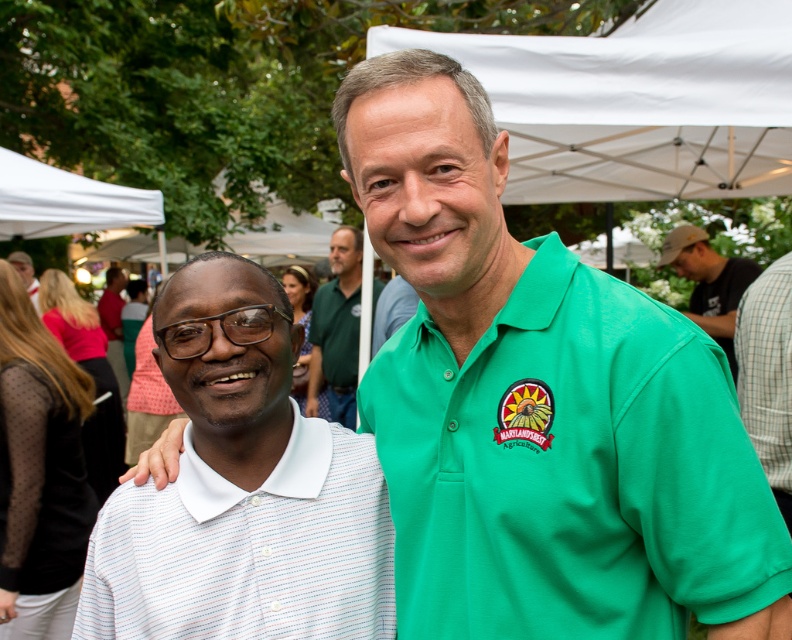
Question: Which point is closer to the camera taking this photo?

Choices:
 (A) (612, 531)
 (B) (310, 340)

Answer: (A)

Question: From the image, what is the correct spatial relationship of white fabric canopy at upper center in relation to green cotton shirt at upper right?

Choices:
 (A) below
 (B) above

Answer: (B)

Question: Which is farther from the white striped polo shirt at left?

Choices:
 (A) green cotton polo shirt at center
 (B) green woven polo shirt at center

Answer: (A)

Question: Which object appears farthest from the camera in this image?

Choices:
 (A) white fabric canopy at upper left
 (B) white fabric canopy at upper center

Answer: (A)

Question: Does green cotton polo shirt at center appear over green cotton shirt at upper right?

Choices:
 (A) no
 (B) yes

Answer: (A)

Question: Can you confirm if green woven polo shirt at center is bigger than white fabric canopy at upper left?

Choices:
 (A) yes
 (B) no

Answer: (B)